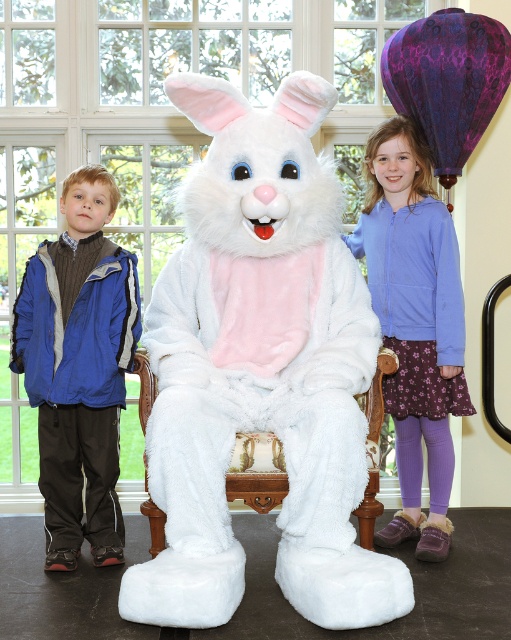
You are a photographer setting up a photo shoot with the fluffy white bunny at center and the blue fleece jacket at left. You want to ensure both subjects are fully visible in the frame. Based on their sizes, which subject should you focus on first to avoid cropping either?

The fluffy white bunny at center is taller than the blue fleece jacket at left, so you should focus on positioning the taller bunny first to ensure it fits within the frame, then adjust for the jacket.

You are a photographer setting up for a group photo. You need to position the blue fleece jacket at left and the white plush chair at center so that the jacket is to the left of the chair. Is the current arrangement correct?

Yes, the current arrangement is correct because the blue fleece jacket at left is positioned on the left side of the white plush chair at center as required.